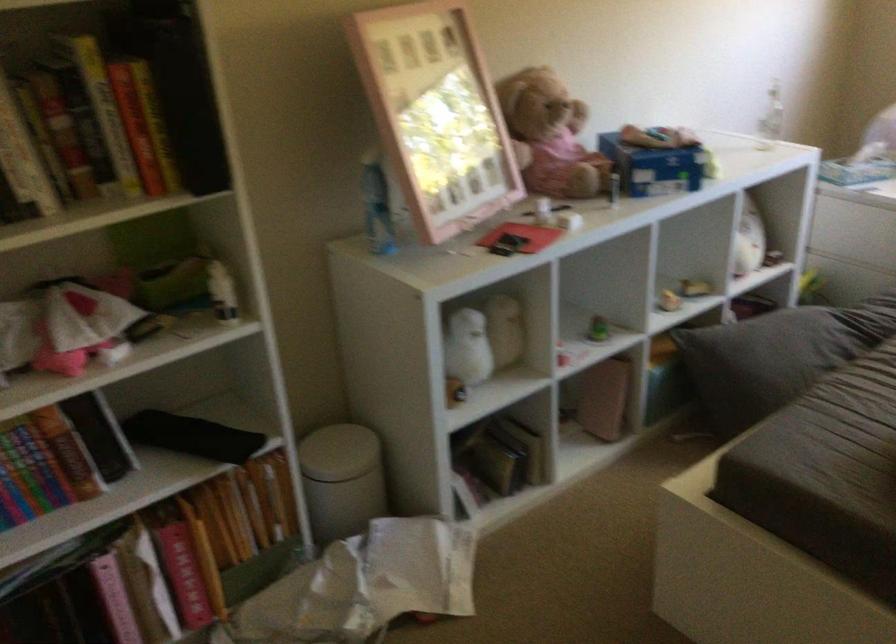
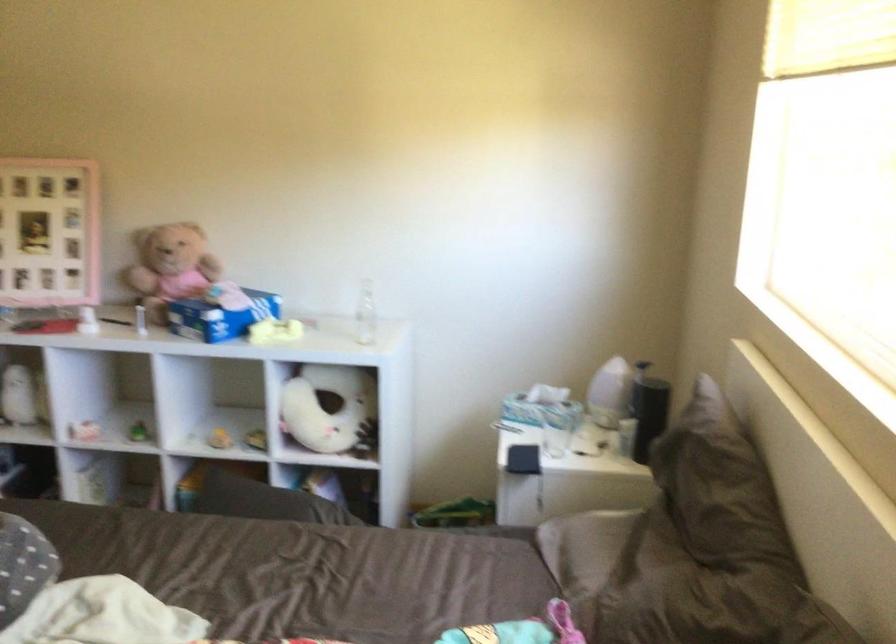
The point at [570,125] is marked in the first image. Where is the corresponding point in the second image?

(170, 267)